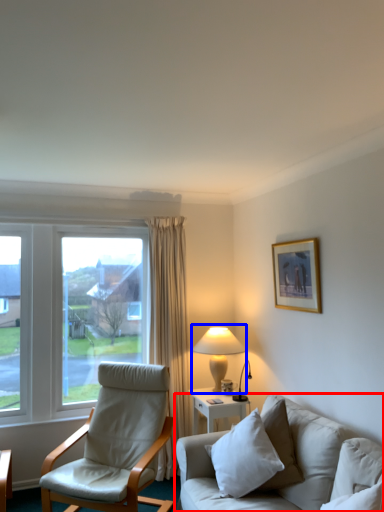
Question: Which point is closer to the camera, studio couch (highlighted by a red box) or table lamp (highlighted by a blue box)?

Choices:
 (A) studio couch
 (B) table lamp

Answer: (A)